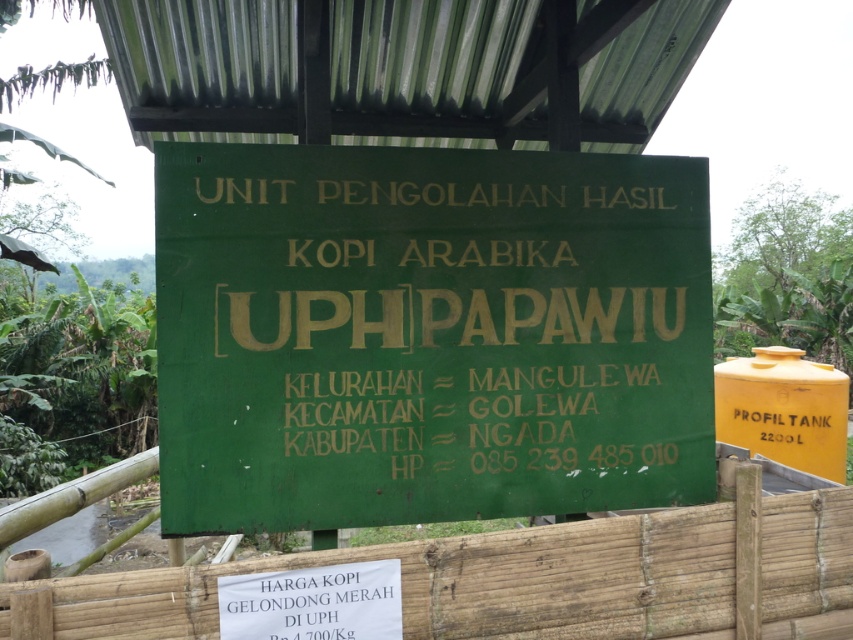
Question: Does green matte signboard at center have a larger size compared to yellow matte tank at right?

Choices:
 (A) no
 (B) yes

Answer: (B)

Question: Which object is the closest to the wooden at center?

Choices:
 (A) green matte signboard at center
 (B) yellow matte tank at right
 (C) white paper sign at lower center

Answer: (C)

Question: Can you confirm if wooden at center is positioned below white paper sign at lower center?

Choices:
 (A) no
 (B) yes

Answer: (A)

Question: Which point appears closest to the camera in this image?

Choices:
 (A) (407, 148)
 (B) (349, 564)

Answer: (B)

Question: Can you confirm if wooden at center is smaller than white paper sign at lower center?

Choices:
 (A) no
 (B) yes

Answer: (A)

Question: Which object is closer to the camera taking this photo?

Choices:
 (A) white paper sign at lower center
 (B) wooden at center

Answer: (B)